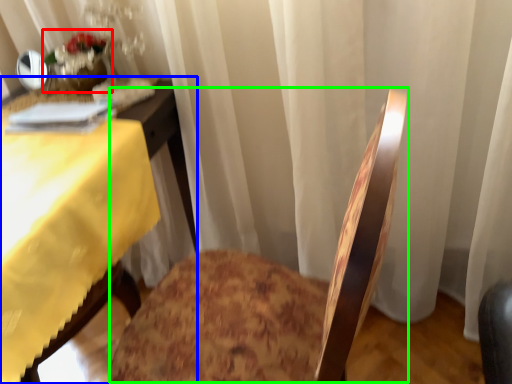
Question: Based on their relative distances, which object is farther from floral arrangement (highlighted by a red box)? Choose from table (highlighted by a blue box) and rocking chair (highlighted by a green box).

Choices:
 (A) table
 (B) rocking chair

Answer: (B)